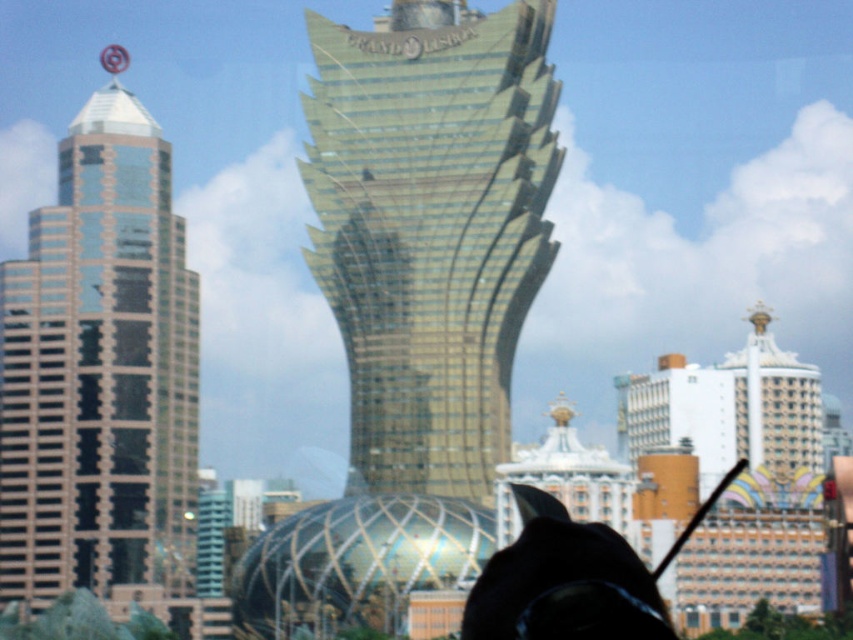
Which is behind, point (612, 564) or point (740, 392)?

Point (740, 392)

Can you confirm if black matte hat at lower center is wider than gold metallic tower at upper right?

Yes, black matte hat at lower center is wider than gold metallic tower at upper right.

Is point (614, 580) less distant than point (798, 394)?

Yes, it is in front of point (798, 394).

This screenshot has height=640, width=853. Find the location of `black matte hat at lower center`. black matte hat at lower center is located at coordinates (563, 582).

Who is positioned more to the left, shiny glass skyscraper at left or black matte hat at lower center?

From the viewer's perspective, shiny glass skyscraper at left appears more on the left side.

Can you confirm if shiny glass skyscraper at left is thinner than black matte hat at lower center?

In fact, shiny glass skyscraper at left might be wider than black matte hat at lower center.

Is point (80, 180) positioned before point (502, 609)?

No, it is not.

In order to click on shiny glass skyscraper at left in this screenshot , I will do `click(100, 371)`.

Which is in front, point (515, 214) or point (606, 604)?

Point (606, 604)

Which is below, gold glass tower at center or black matte hat at lower center?

black matte hat at lower center is lower down.

Find the location of `gold glass tower at center`. gold glass tower at center is located at coordinates (415, 298).

This screenshot has width=853, height=640. I want to click on gold glass tower at center, so click(415, 298).